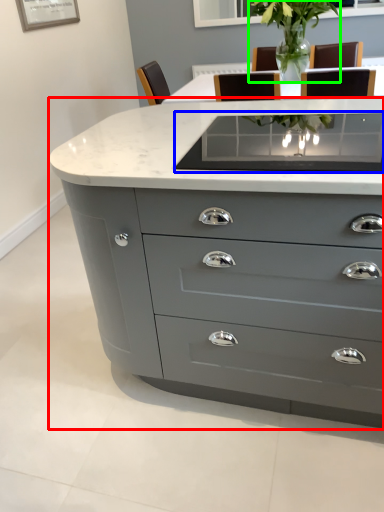
Question: Which object is positioned closest to chest of drawers (highlighted by a red box)? Select from glass table (highlighted by a blue box) and plant (highlighted by a green box).

Choices:
 (A) glass table
 (B) plant

Answer: (A)